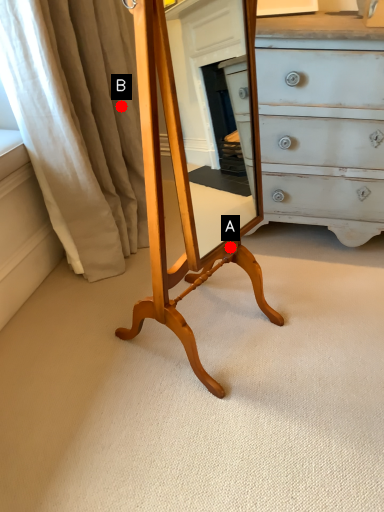
Question: Two points are circled on the image, labeled by A and B beside each circle. Which point is further to the camera?

Choices:
 (A) A is further
 (B) B is further

Answer: (B)